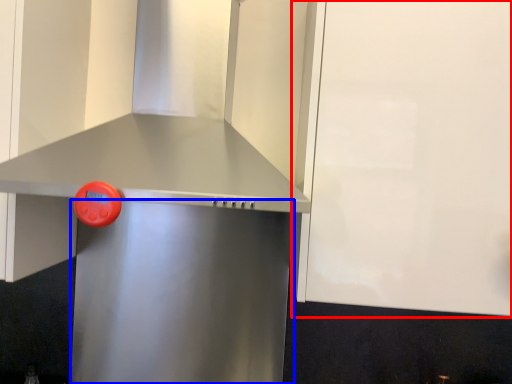
Question: Which point is further to the camera, cabinetry (highlighted by a red box) or appliance (highlighted by a blue box)?

Choices:
 (A) cabinetry
 (B) appliance

Answer: (B)